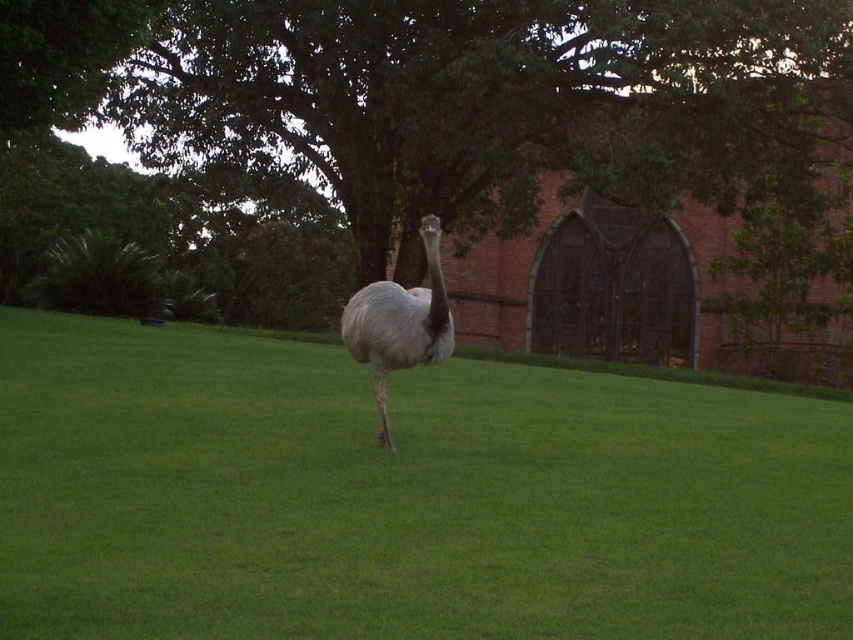
You are a photographer trying to capture both the green leafy tree at center and the gray feathered ostrich at center in the same frame. Based on their sizes, which object will appear wider in your photo?

The green leafy tree at center will appear wider in the photo because its width surpasses that of the gray feathered ostrich at center.

You are standing in the grassy area and see a point marked at coordinates [450,97]. What object is located at that point?

The point at coordinates [450,97] corresponds to the green leafy tree at center.